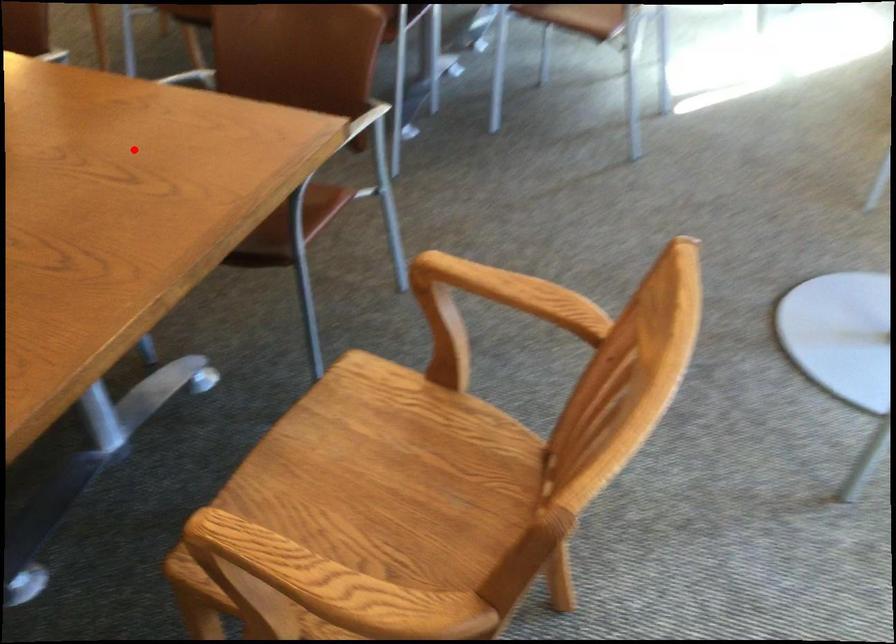
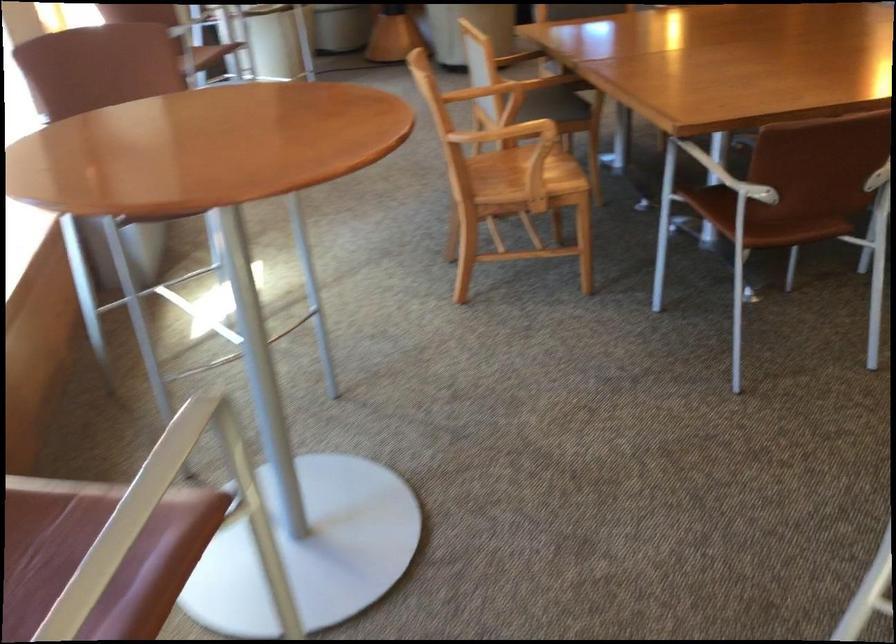
In the second image, find the point that corresponds to the highlighted location in the first image.

(728, 176)